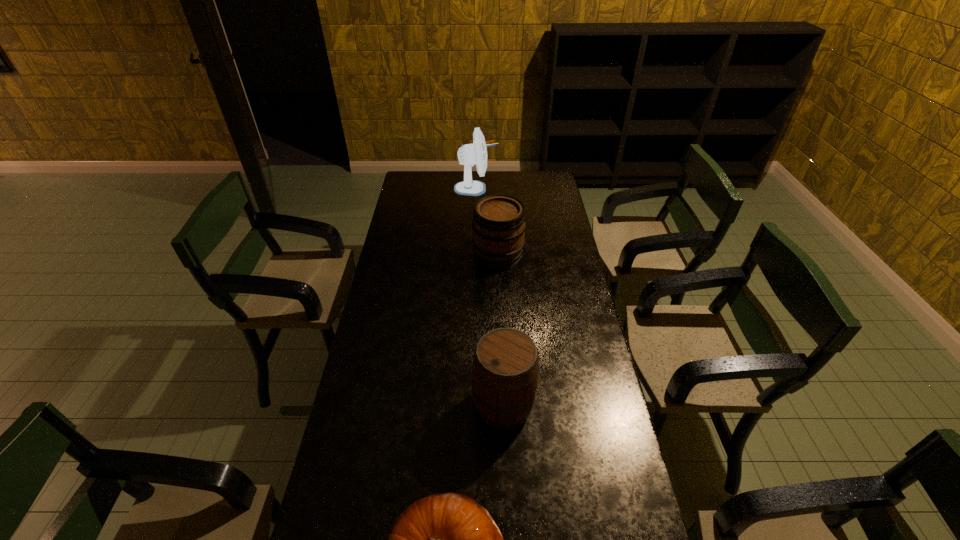
The image size is (960, 540). What are the coordinates of `fan` in the screenshot? It's located at (469, 154).

The width and height of the screenshot is (960, 540). What are the coordinates of `the farthest object` in the screenshot? It's located at (469, 154).

At what (x,y) coordinates should I click in order to perform the action: click on the third farthest object. Please return your answer as a coordinate pair (x, y). This screenshot has height=540, width=960. Looking at the image, I should click on (505, 371).

Find the location of `the farther cider`. the farther cider is located at coordinates coord(499,224).

You are a GUI agent. You are given a task and a screenshot of the screen. Output one action in this format:
    pyautogui.click(x=<x>, y=<y>)
    Task: Click on the free spot located on the grille of the farthest object
    Image resolution: width=960 pixels, height=540 pixels.
    Given the screenshot: What is the action you would take?
    coord(509,188)

I want to click on vacant space situated on the back of the nearer cider, so click(x=501, y=360).

This screenshot has height=540, width=960. Find the location of `vacant area located on the left of the third nearest object`. vacant area located on the left of the third nearest object is located at coordinates [394, 255].

You are a GUI agent. You are given a task and a screenshot of the screen. Output one action in this format:
    pyautogui.click(x=<x>, y=<y>)
    Task: Click on the object that is at the far edge
    The height and width of the screenshot is (540, 960).
    Given the screenshot: What is the action you would take?
    coord(469,154)

In the image, there is a desktop. Where is `free region at the far edge`? The image size is (960, 540). free region at the far edge is located at coordinates (491, 171).

This screenshot has width=960, height=540. In order to click on vacant area at the left edge in this screenshot , I will do `click(426, 195)`.